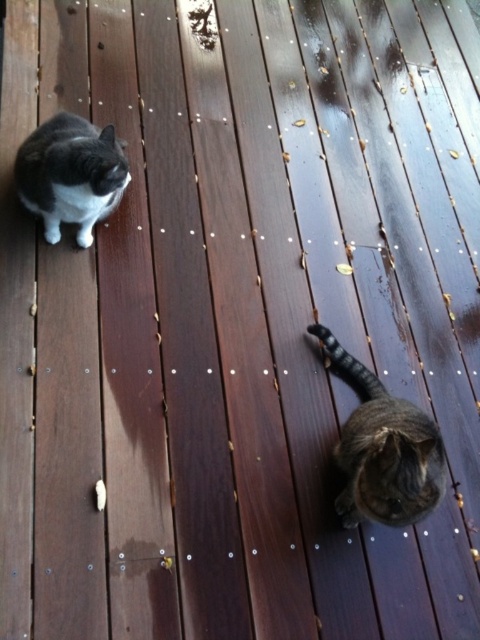
Question: Does brown fur cat at lower right have a larger size compared to gray-white fur cat at upper left?

Choices:
 (A) yes
 (B) no

Answer: (B)

Question: Among these points, which one is nearest to the camera?

Choices:
 (A) (399, 417)
 (B) (41, 145)

Answer: (A)

Question: Does brown fur cat at lower right have a lesser width compared to gray-white fur cat at upper left?

Choices:
 (A) no
 (B) yes

Answer: (B)

Question: Which point appears closest to the camera in this image?

Choices:
 (A) (91, 214)
 (B) (350, 360)

Answer: (A)

Question: Does brown fur cat at lower right appear on the right side of gray-white fur cat at upper left?

Choices:
 (A) no
 (B) yes

Answer: (B)

Question: Which object is farther from the camera taking this photo?

Choices:
 (A) gray-white fur cat at upper left
 (B) brown fur cat at lower right

Answer: (A)